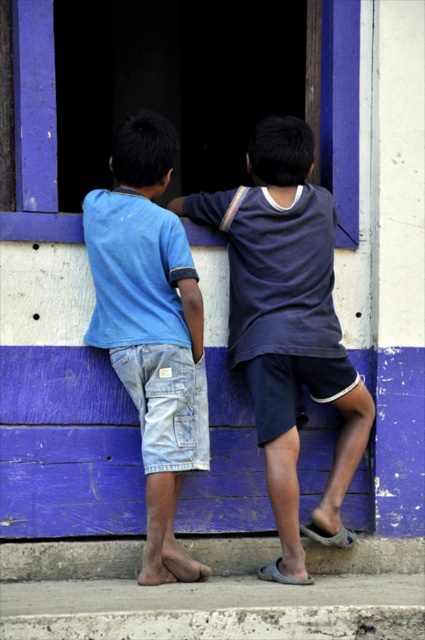
Which of these two, dark blue cotton shirt at center or light blue denim shorts at center, stands taller?

With more height is dark blue cotton shirt at center.

Does dark blue cotton shirt at center have a lesser height compared to light blue denim shorts at center?

In fact, dark blue cotton shirt at center may be taller than light blue denim shorts at center.

Which is behind, point (316, 352) or point (195, 275)?

The point (316, 352) is more distant.

The height and width of the screenshot is (640, 425). In order to click on dark blue cotton shirt at center in this screenshot , I will do `click(288, 324)`.

Can you confirm if light blue denim shorts at center is smaller than blue wooden window at upper center?

Actually, light blue denim shorts at center might be larger than blue wooden window at upper center.

Between point (152, 264) and point (189, 236), which one is positioned behind?

Positioned behind is point (189, 236).

Is point (105, 342) positioned behind point (17, 86)?

No, it is in front of (17, 86).

Where is `light blue denim shorts at center`? The image size is (425, 640). light blue denim shorts at center is located at coordinates (150, 326).

Is dark blue cotton shirt at center bigger than blue wooden window at upper center?

Indeed, dark blue cotton shirt at center has a larger size compared to blue wooden window at upper center.

Is dark blue cotton shirt at center to the right of blue wooden window at upper center from the viewer's perspective?

In fact, dark blue cotton shirt at center is to the left of blue wooden window at upper center.

Who is more distant from viewer, (297,177) or (187,230)?

The point (187,230) is more distant.

You are a GUI agent. You are given a task and a screenshot of the screen. Output one action in this format:
    pyautogui.click(x=<x>, y=<y>)
    Task: Click on the dark blue cotton shirt at center
    This screenshot has width=425, height=640.
    Given the screenshot: What is the action you would take?
    pyautogui.click(x=288, y=324)